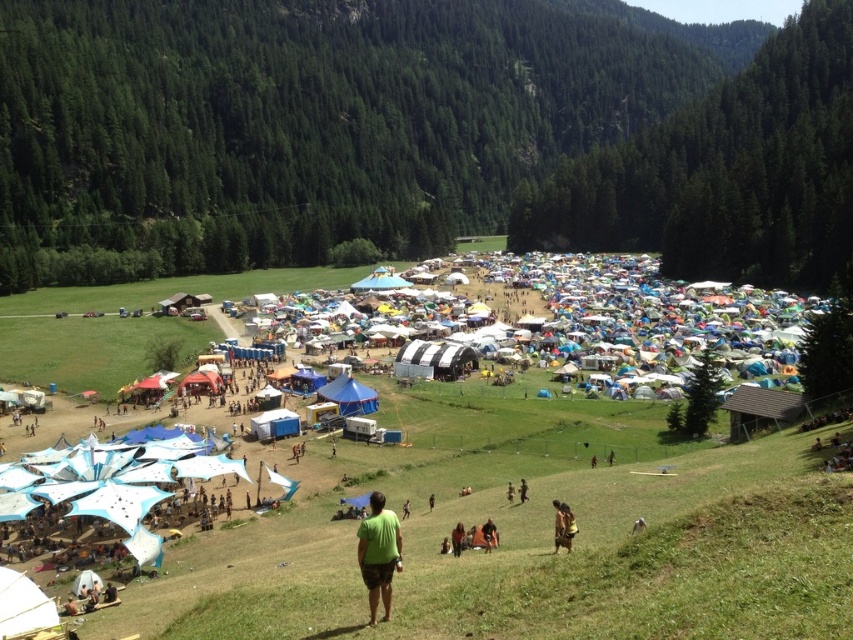
You are a photographer at the event and want to capture a photo of the green matte shirt at lower center without any obstructions. Since the blue fabric tent at center is nearby, will the tent block the view of the shirt?

The green matte shirt at lower center is positioned under the blue fabric tent at center, so the tent will block the view of the shirt.